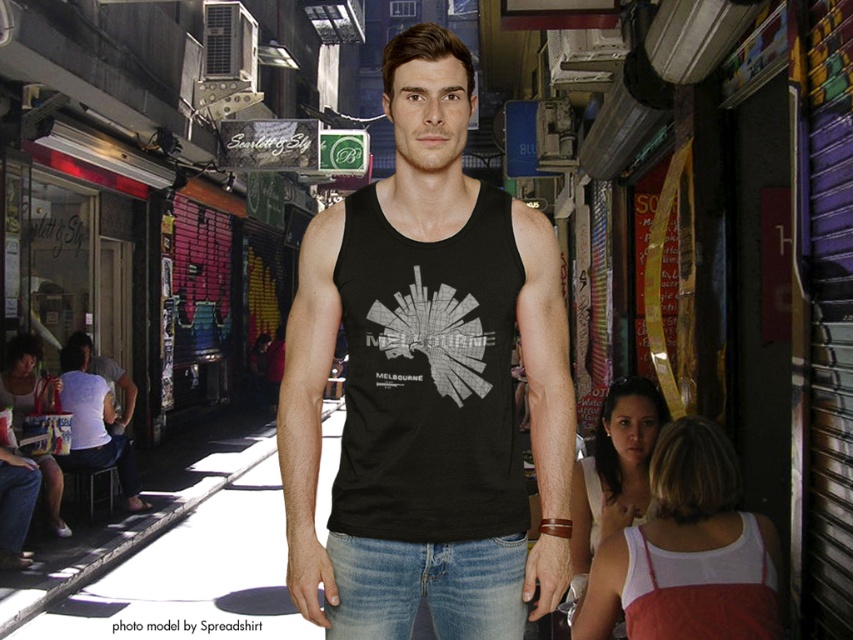
You are a fashion designer analyzing the image. The black heather tank top at center is part of a new collection. Where on the body should this tank top be worn according to its position in the image?

The black heather tank top at center is positioned at point (428, 378), which corresponds to the torso area of the man in the image. Therefore, this tank top should be worn on the upper body, specifically the torso.

You are a fashion designer analyzing the man in the image. You need to determine which item of clothing is larger between the black heather tank top at center and the denim at center. Which one is bigger?

The black heather tank top at center is bigger than the denim at center.